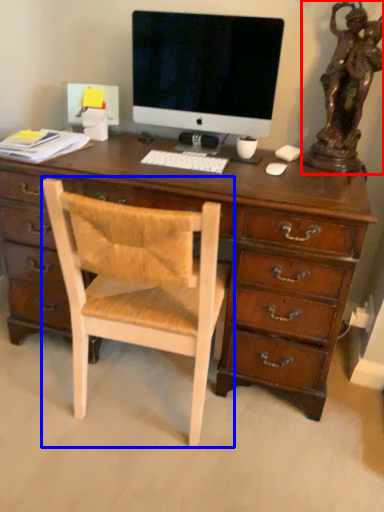
Question: Which object appears farthest to the camera in this image, bronze statue (highlighted by a red box) or chair (highlighted by a blue box)?

Choices:
 (A) bronze statue
 (B) chair

Answer: (A)